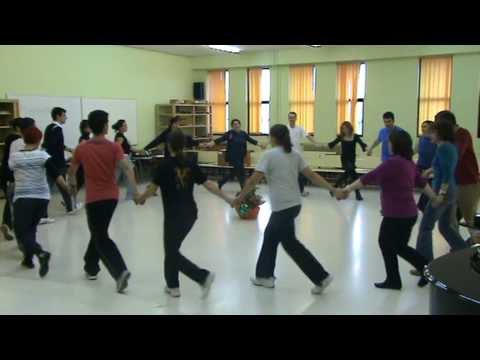
Where is `wall`? This screenshot has width=480, height=360. wall is located at coordinates (107, 83).